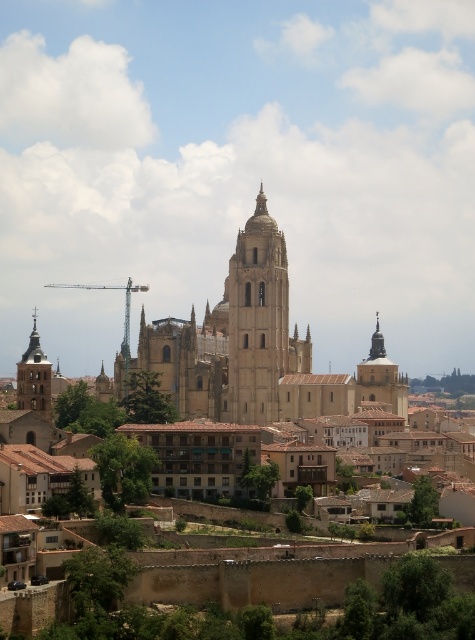
Between smooth beige tower at center and smooth stone tower at center right, which one appears on the left side from the viewer's perspective?

smooth beige tower at center

Between smooth beige tower at center and smooth stone tower at center right, which one is positioned lower?

Positioned lower is smooth stone tower at center right.

Does point (267, 372) come closer to viewer compared to point (405, 378)?

Yes.

The height and width of the screenshot is (640, 475). What are the coordinates of `smooth beige tower at center` in the screenshot? It's located at (257, 320).

Which is in front, point (404, 417) or point (49, 385)?

Point (49, 385) is in front.

Measure the distance between smooth stone tower at center right and camera.

They are 656.27 feet apart.

Image resolution: width=475 pixels, height=640 pixels. What are the coordinates of `smooth stone tower at center right` in the screenshot? It's located at (380, 378).

Measure the distance between point (182,486) and camera.

Point (182,486) is 153.20 meters away from camera.

Is point (300, 340) positioned behind point (286, 317)?

Yes, it is.

Between point (170, 372) and point (263, 228), which one is positioned in front?

Point (170, 372) is in front.

I want to click on brown stone town at center, so click(x=246, y=346).